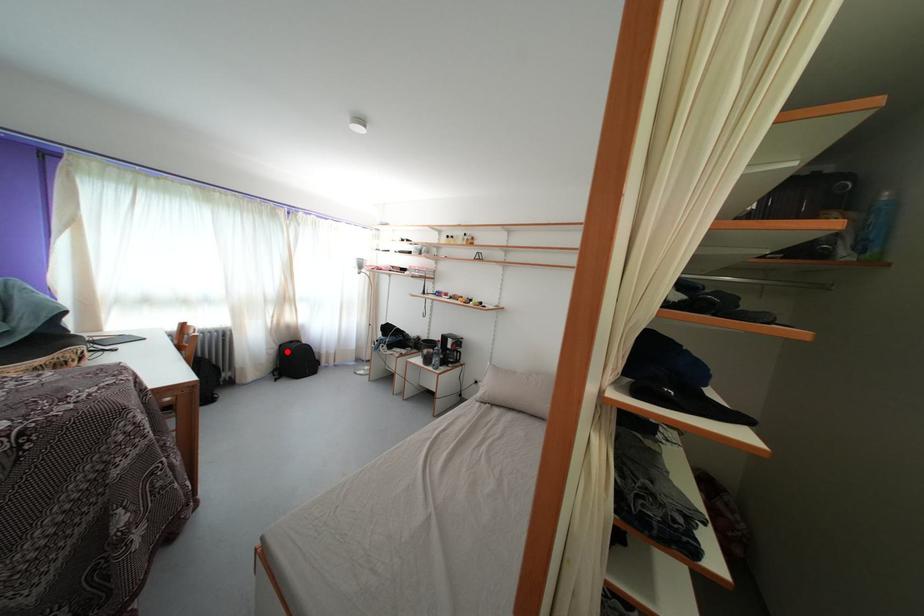
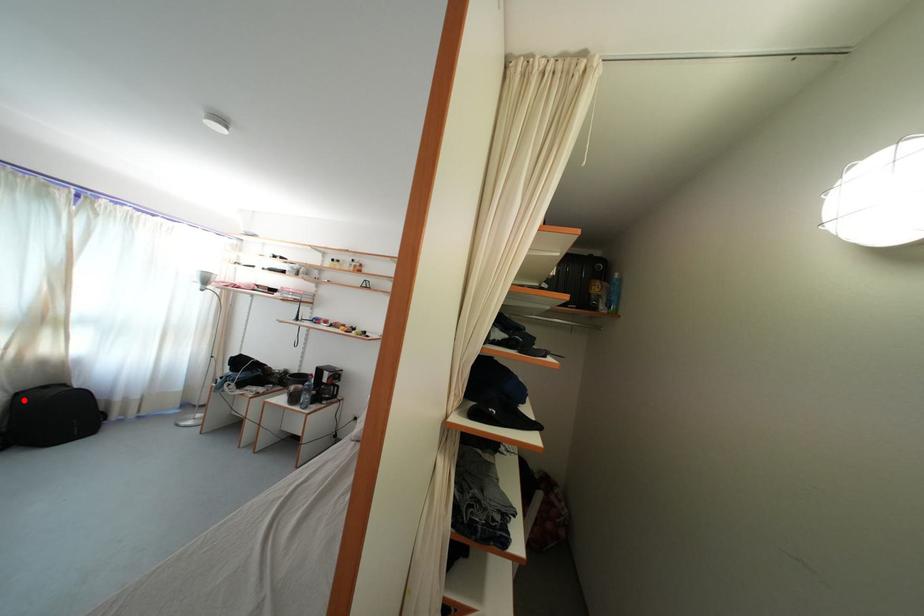
I am providing you with two images of the same scene from different viewpoints. A red point is marked on the first image and another point is marked on the second image. Are the points marked in image1 and image2 representing the same 3D position?

Yes